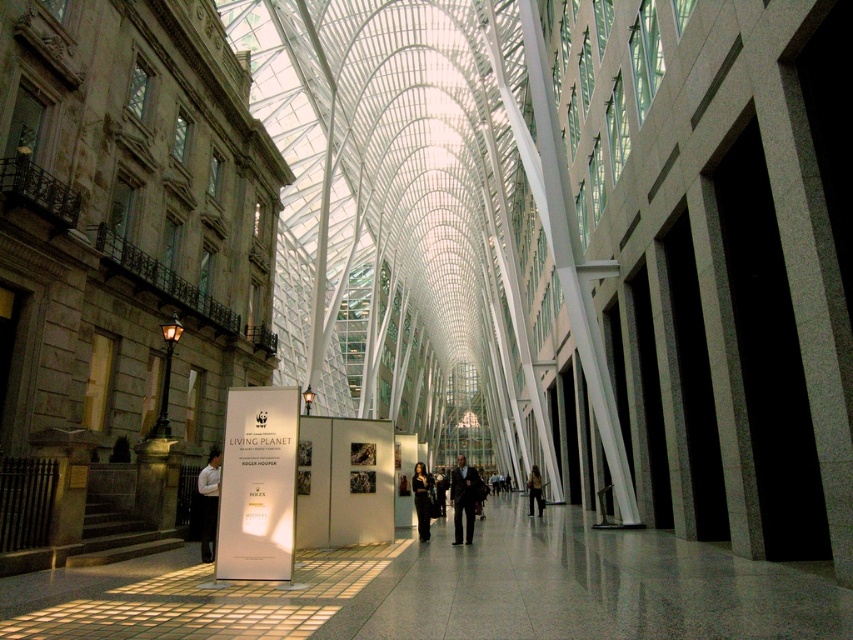
Can you confirm if white shirt at center is positioned to the right of dark suit at center?

In fact, white shirt at center is to the left of dark suit at center.

Is white shirt at center shorter than dark suit at center?

Yes, white shirt at center is shorter than dark suit at center.

Is point (218, 458) positioned after point (473, 512)?

No.

This screenshot has height=640, width=853. What are the coordinates of `white shirt at center` in the screenshot? It's located at (209, 502).

Can you confirm if black fabric dress at center is bigger than dark brown leather jacket at center?

Actually, black fabric dress at center might be smaller than dark brown leather jacket at center.

In the scene shown: Is black fabric dress at center positioned at the back of dark brown leather jacket at center?

No, it is not.

At what (x,y) coordinates should I click in order to perform the action: click on black fabric dress at center. Please return your answer as a coordinate pair (x, y). Looking at the image, I should click on (421, 499).

Is dark suit at center wider than black fabric dress at center?

Yes.

Which is in front, point (460, 474) or point (416, 497)?

Point (460, 474) is more forward.

Who is more distant from viewer, (456, 518) or (415, 477)?

Point (415, 477)

Find the location of a particular element. The image size is (853, 640). dark suit at center is located at coordinates (463, 497).